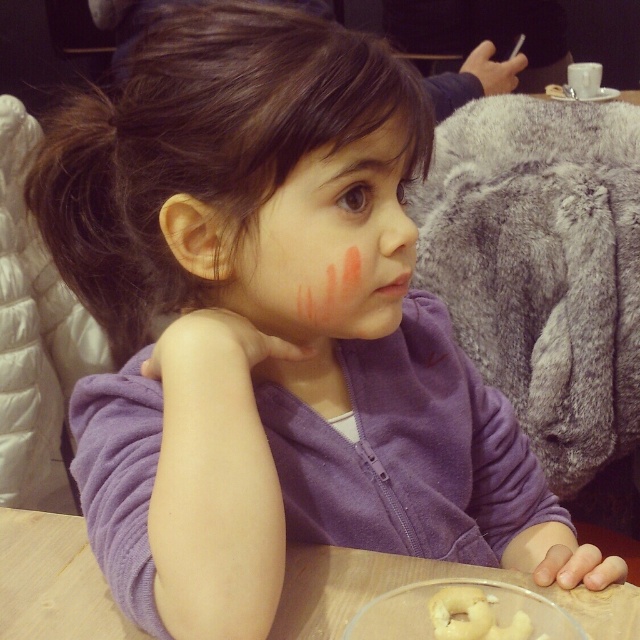
You are a photographer trying to capture the matte pink blush at center and the fuzzy gray stuffed animal at right in a single shot. Which object should you focus on first to ensure both are in focus?

You should focus on the fuzzy gray stuffed animal at right first because it is closer to you than the matte pink blush at center, so focusing on the closer object will help both be in focus.

You are an artist analyzing the composition of this image. The matte pink blush at center is positioned at coordinates. What are its coordinates?

The matte pink blush at center is located at coordinates (328, 244).